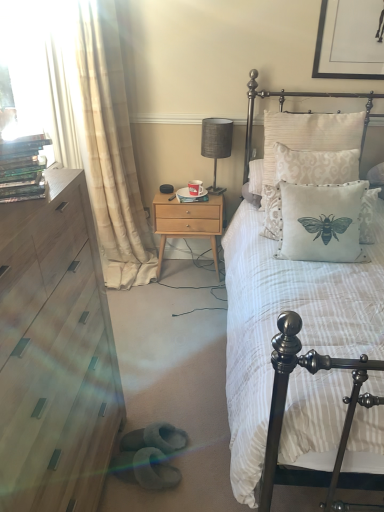
Question: Should I look upward or downward to see silk-patterned pillow at upper right?

Choices:
 (A) down
 (B) up

Answer: (B)

Question: Is white fabric pillow with bee design at center, the 2th pillow from the top, shorter than matte gray fabric table lamp at center?

Choices:
 (A) yes
 (B) no

Answer: (A)

Question: Is white fabric pillow with bee design at center, the 2th pillow from the top, bigger than matte gray fabric table lamp at center?

Choices:
 (A) yes
 (B) no

Answer: (A)

Question: Is white fabric pillow with bee design at center, the first pillow ordered from the bottom, at the right side of matte gray fabric table lamp at center?

Choices:
 (A) yes
 (B) no

Answer: (A)

Question: Could you tell me if white fabric pillow with bee design at center, the first pillow ordered from the bottom, is turned towards matte gray fabric table lamp at center?

Choices:
 (A) yes
 (B) no

Answer: (B)

Question: Is white fabric pillow with bee design at center, the first pillow ordered from the bottom, taller than matte gray fabric table lamp at center?

Choices:
 (A) no
 (B) yes

Answer: (A)

Question: From a real-world perspective, is white fabric pillow with bee design at center, the 2th pillow from the top, positioned under matte gray fabric table lamp at center based on gravity?

Choices:
 (A) no
 (B) yes

Answer: (B)

Question: From the image's perspective, would you say white striped fabric bed at center is shown under transparent plastic dvds at left?

Choices:
 (A) no
 (B) yes

Answer: (B)

Question: Is white striped fabric bed at center placed right next to transparent plastic dvds at left?

Choices:
 (A) no
 (B) yes

Answer: (A)

Question: Does white striped fabric bed at center have a larger size compared to transparent plastic dvds at left?

Choices:
 (A) yes
 (B) no

Answer: (A)

Question: Could transparent plastic dvds at left be considered to be inside white striped fabric bed at center?

Choices:
 (A) no
 (B) yes

Answer: (A)

Question: Is white striped fabric bed at center turned away from transparent plastic dvds at left?

Choices:
 (A) no
 (B) yes

Answer: (A)

Question: Could you tell me if white striped fabric bed at center is facing transparent plastic dvds at left?

Choices:
 (A) yes
 (B) no

Answer: (B)

Question: Considering the relative sizes of silk-patterned pillow at upper right and creamy beige fabric pillow at upper right, which is counted as the 2th pillow, starting from the bottom, in the image provided, is silk-patterned pillow at upper right wider than creamy beige fabric pillow at upper right, which is counted as the 2th pillow, starting from the bottom,?

Choices:
 (A) no
 (B) yes

Answer: (B)